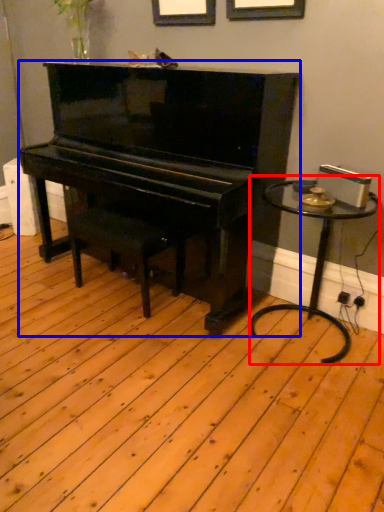
Question: Which object appears farthest to the camera in this image, table (highlighted by a red box) or piano (highlighted by a blue box)?

Choices:
 (A) table
 (B) piano

Answer: (A)